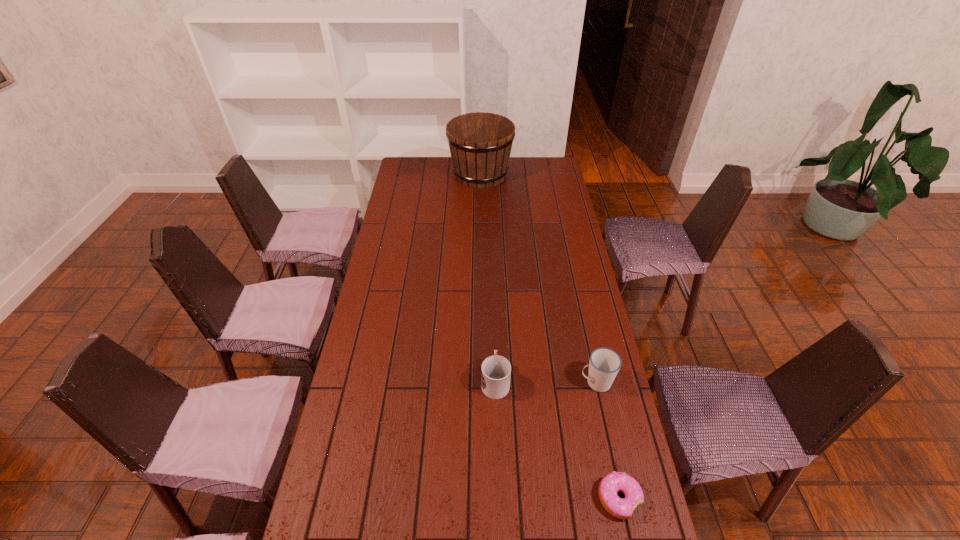
This screenshot has width=960, height=540. In order to click on vacant space at the far left corner of the desktop in this screenshot , I will do `click(425, 161)`.

You are a GUI agent. You are given a task and a screenshot of the screen. Output one action in this format:
    pyautogui.click(x=<x>, y=<y>)
    Task: Click on the free space at the far right corner
    
    Given the screenshot: What is the action you would take?
    pyautogui.click(x=544, y=168)

This screenshot has height=540, width=960. Find the location of `vacant area between the doughnut and the farthest object`. vacant area between the doughnut and the farthest object is located at coordinates (550, 336).

The height and width of the screenshot is (540, 960). Identify the location of empty space that is in between the tallest object and the right cup. (539, 278).

This screenshot has width=960, height=540. Find the location of `free spot between the doughnut and the second shortest object`. free spot between the doughnut and the second shortest object is located at coordinates (557, 440).

The height and width of the screenshot is (540, 960). In order to click on vacant area that lies between the tallest object and the right cup in this screenshot , I will do `click(539, 278)`.

You are a GUI agent. You are given a task and a screenshot of the screen. Output one action in this format:
    pyautogui.click(x=<x>, y=<y>)
    Task: Click on the vacant area between the shortest object and the left cup
    
    Given the screenshot: What is the action you would take?
    click(557, 440)

I want to click on vacant space in between the tallest object and the left cup, so 488,278.

You are a GUI agent. You are given a task and a screenshot of the screen. Output one action in this format:
    pyautogui.click(x=<x>, y=<y>)
    Task: Click on the empty space between the nearest object and the left cup
    
    Given the screenshot: What is the action you would take?
    pyautogui.click(x=557, y=440)

Find the location of a particular element. The width and height of the screenshot is (960, 540). empty space between the right cup and the doughnut is located at coordinates (608, 441).